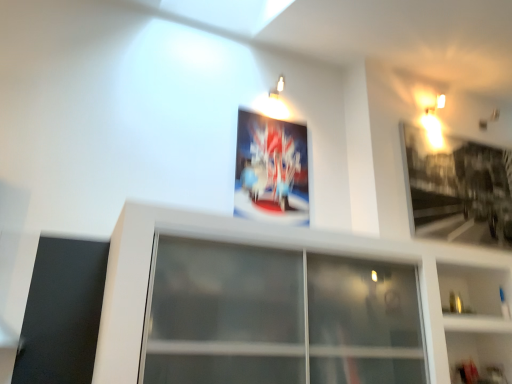
Question: Considering the relative sizes of transparent glass window at center and white glossy shelf at lower right in the image provided, is transparent glass window at center shorter than white glossy shelf at lower right?

Choices:
 (A) no
 (B) yes

Answer: (B)

Question: Is transparent glass window at center not within white glossy shelf at lower right?

Choices:
 (A) no
 (B) yes

Answer: (B)

Question: Considering the relative sizes of transparent glass window at center and white glossy shelf at lower right in the image provided, is transparent glass window at center taller than white glossy shelf at lower right?

Choices:
 (A) no
 (B) yes

Answer: (A)

Question: Does transparent glass window at center appear on the left side of white glossy shelf at lower right?

Choices:
 (A) yes
 (B) no

Answer: (A)

Question: From a real-world perspective, is transparent glass window at center on white glossy shelf at lower right?

Choices:
 (A) no
 (B) yes

Answer: (B)

Question: Is metallic silver picture frame at upper right, the 1th picture frame viewed from the right, inside the boundaries of white glossy shelf at lower right, or outside?

Choices:
 (A) inside
 (B) outside

Answer: (B)

Question: Considering the positions of point (486, 198) and point (473, 292), is point (486, 198) closer or farther from the camera than point (473, 292)?

Choices:
 (A) closer
 (B) farther

Answer: (B)

Question: From a real-world perspective, is metallic silver picture frame at upper right, which is the 2th picture frame in left-to-right order, physically located above or below white glossy shelf at lower right?

Choices:
 (A) below
 (B) above

Answer: (B)

Question: Would you say metallic silver picture frame at upper right, the 1th picture frame viewed from the right, is to the left or to the right of white glossy shelf at lower right in the picture?

Choices:
 (A) right
 (B) left

Answer: (A)

Question: Is transparent glass window at center taller or shorter than metallic poster at center, which is counted as the first picture frame, starting from the left?

Choices:
 (A) short
 (B) tall

Answer: (A)

Question: From the image's perspective, relative to metallic poster at center, which is the second picture frame in right-to-left order, is transparent glass window at center above or below?

Choices:
 (A) above
 (B) below

Answer: (B)

Question: Is transparent glass window at center in front of or behind metallic poster at center, which is counted as the first picture frame, starting from the left, in the image?

Choices:
 (A) behind
 (B) front

Answer: (B)

Question: Considering the positions of point (169, 357) and point (265, 147), is point (169, 357) closer or farther from the camera than point (265, 147)?

Choices:
 (A) farther
 (B) closer

Answer: (B)

Question: From their relative heights in the image, would you say metallic silver picture frame at upper right, the 1th picture frame viewed from the right, is taller or shorter than transparent glass window at center?

Choices:
 (A) tall
 (B) short

Answer: (A)

Question: Does point (499, 215) appear closer or farther from the camera than point (273, 319)?

Choices:
 (A) closer
 (B) farther

Answer: (B)